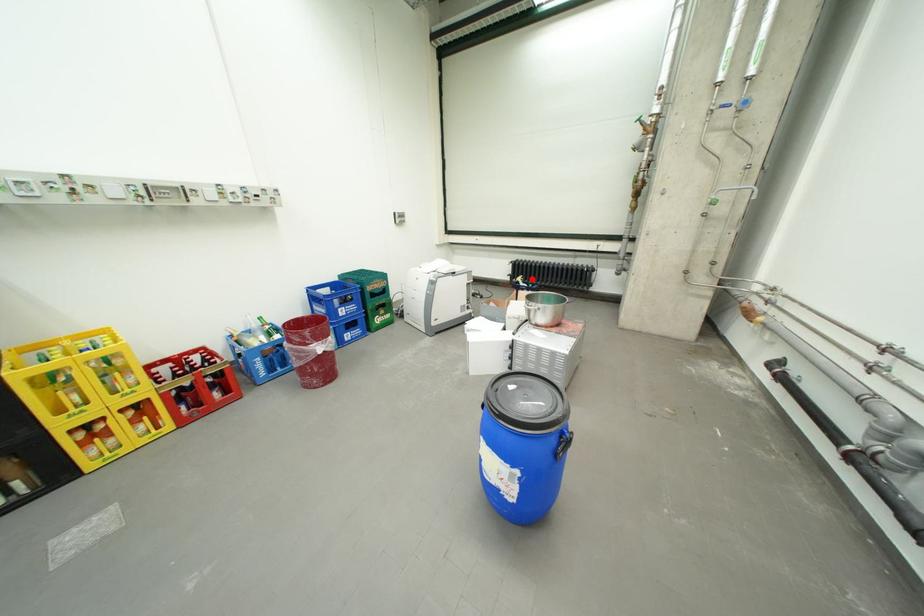
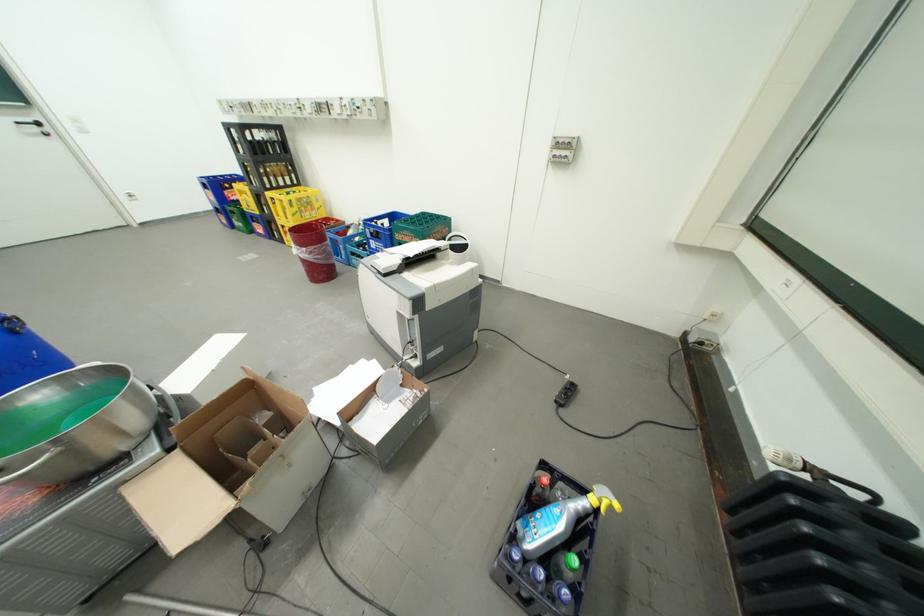
Where in the second image is the point corresponding to the highlighted location from the first image?

(622, 509)